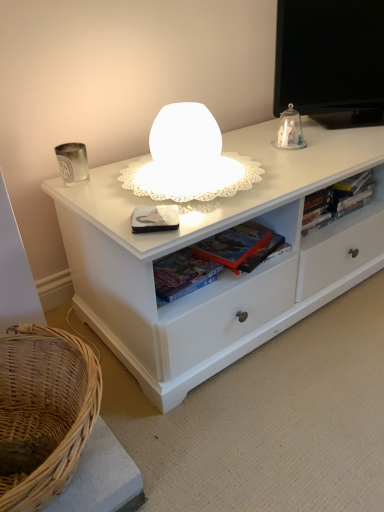
This screenshot has width=384, height=512. What are the coordinates of `free point above hardcover book at center, which appears as the second book when viewed from the left (from a real-world perspective)` in the screenshot? It's located at (239, 242).